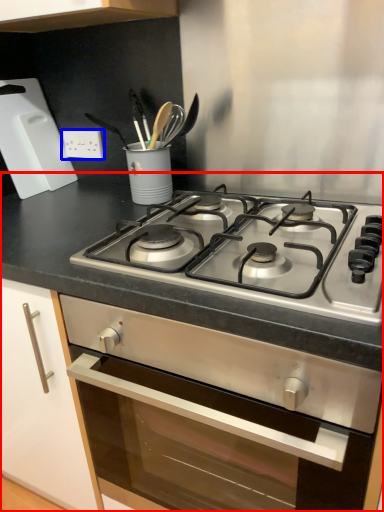
Question: Which object appears closest to the camera in this image, countertop (highlighted by a red box) or electric outlet (highlighted by a blue box)?

Choices:
 (A) countertop
 (B) electric outlet

Answer: (A)